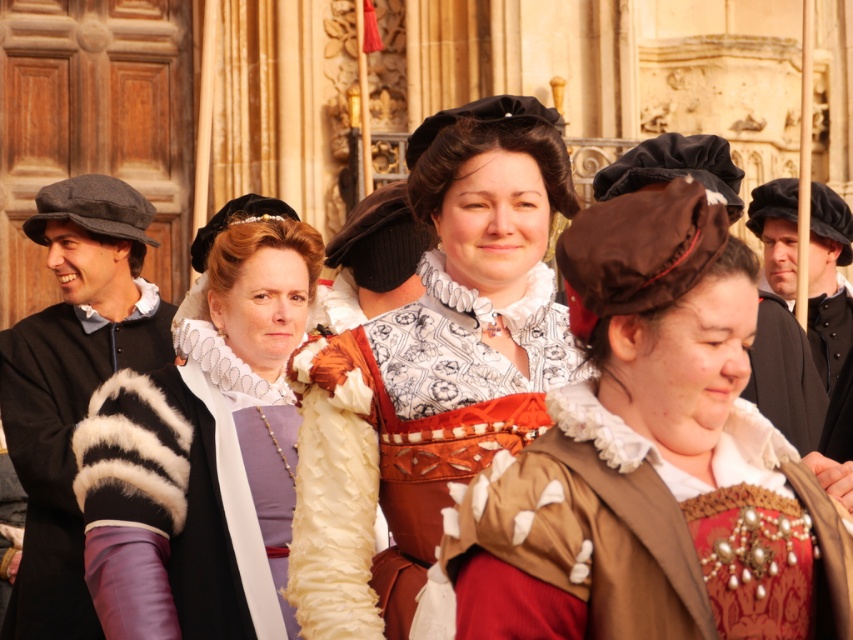
You are standing in front of the historical scene with the two points marked in the image. Which point, point (660, 284) or point (798, 342), is nearer to you?

Point (660, 284) is closer to the viewer than point (798, 342).

You are a photographer at the event and want to ensure the velvet brown dress at center and the brown felt hat at center are both visible in the photo. Given their sizes, which one might appear smaller in the frame?

The velvet brown dress at center is not as tall as the brown felt hat at center, so the velvet brown dress at center would appear smaller in the frame.

You are a photographer at the event and need to ensure that the velvet brown dress at center and the matte white ruffled collar at center are both visible in the photo. Given their sizes, which one might require you to adjust your camera angle to capture fully?

The velvet brown dress at center is not as tall as the matte white ruffled collar at center, so the matte white ruffled collar at center may require adjusting the camera angle to ensure it fits within the frame.